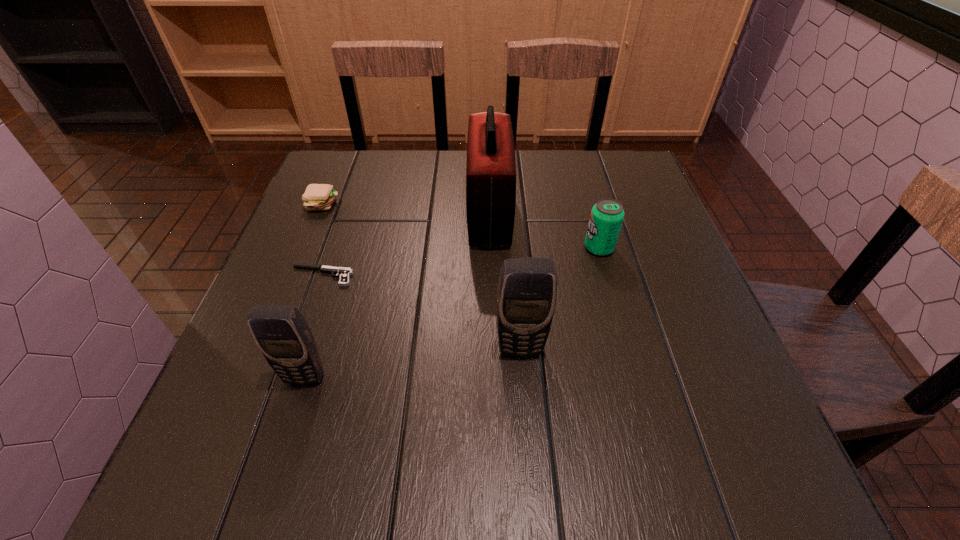
At what (x,y) coordinates should I click in order to perform the action: click on vacant area located on the front face of the left cellular telephone. Please return your answer as a coordinate pair (x, y). The height and width of the screenshot is (540, 960). Looking at the image, I should click on (294, 414).

This screenshot has height=540, width=960. I want to click on free space located 0.080m on the front face of the farther cellular telephone, so click(524, 400).

Where is `free region located 0.140m on the front of the patty`? This screenshot has height=540, width=960. free region located 0.140m on the front of the patty is located at coordinates (302, 254).

Find the location of `vacant space located on the front-facing side of the pop soda`. vacant space located on the front-facing side of the pop soda is located at coordinates (563, 248).

Where is `blank space located on the front-facing side of the pop soda`? blank space located on the front-facing side of the pop soda is located at coordinates (492, 248).

What are the coordinates of `free space located on the front-facing side of the pop soda` in the screenshot? It's located at (549, 248).

Identify the location of free space located on the side of the first aid kit with the cross symbol. (391, 215).

Find the location of `blank space located 0.230m on the side of the first aid kit with the cross symbol`. blank space located 0.230m on the side of the first aid kit with the cross symbol is located at coordinates (374, 215).

Where is `blank space located 0.130m on the side of the first aid kit with the cross symbol`? blank space located 0.130m on the side of the first aid kit with the cross symbol is located at coordinates (415, 215).

You are a GUI agent. You are given a task and a screenshot of the screen. Output one action in this format:
    pyautogui.click(x=<x>, y=<y>)
    Task: Click on the patty that is positioned at the far edge
    
    Given the screenshot: What is the action you would take?
    pyautogui.click(x=317, y=196)